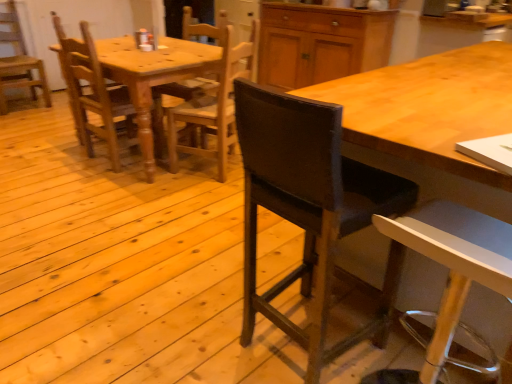
At what (x,y) coordinates should I click in order to perform the action: click on free space between wooden chair at center, acting as the 4th chair starting from the front, and dark brown leather chair at center, which is the 2th chair from front to back. Please return your answer as a coordinate pair (x, y). The height and width of the screenshot is (384, 512). Looking at the image, I should click on (176, 233).